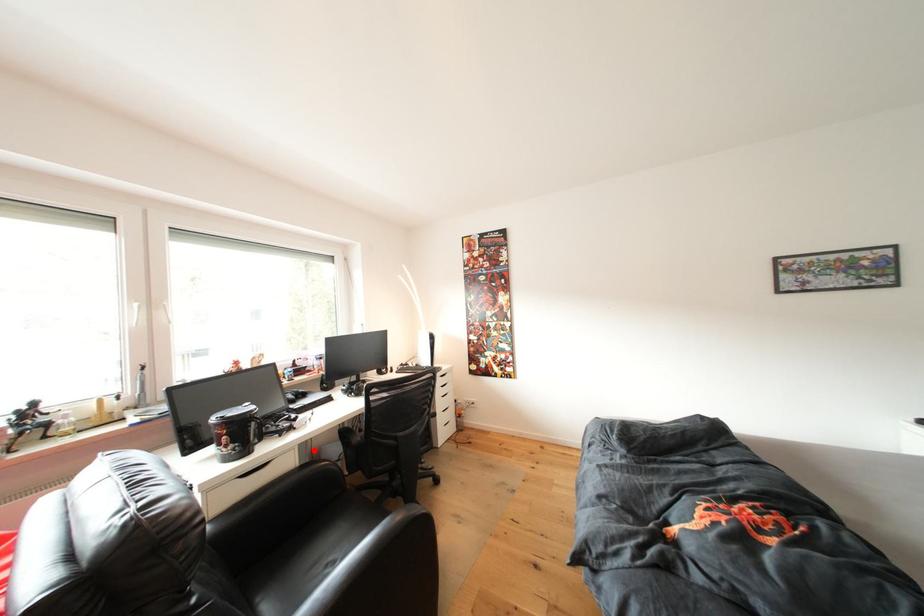
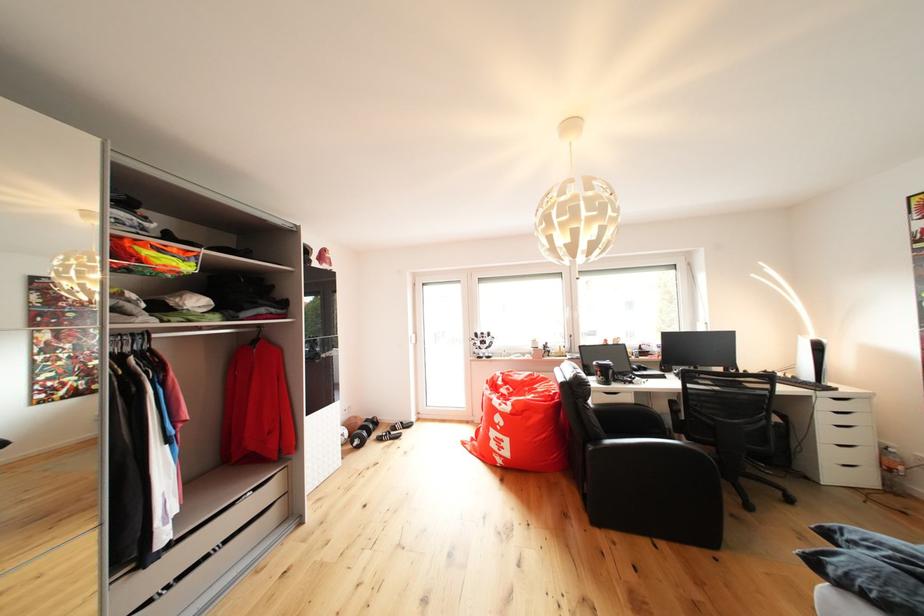
The point at the highlighted location is marked in the first image. Where is the corresponding point in the second image?

(647, 399)